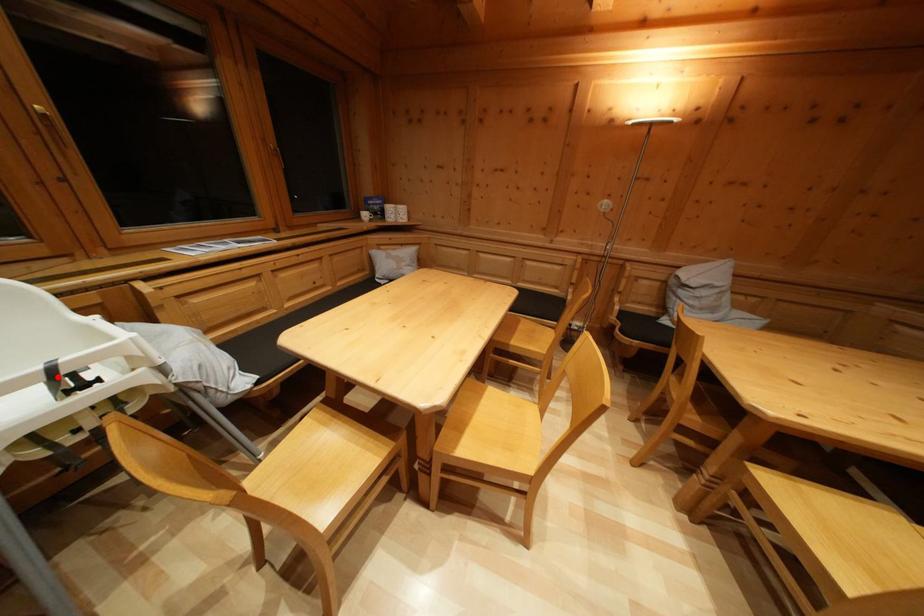
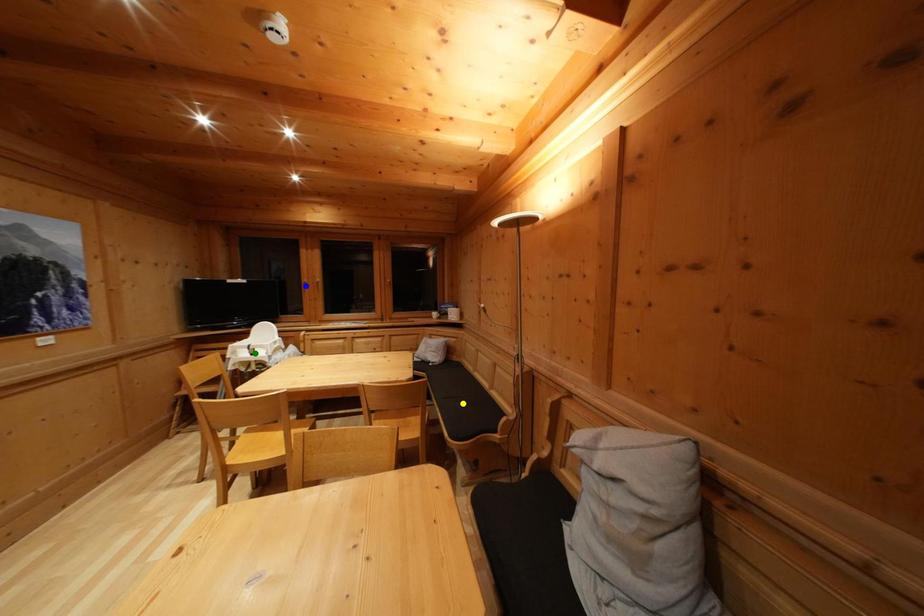
Question: I am providing you with two images of the same scene from different viewpoints. A red point is marked on the first image. You are given multiple points on the second image. Which point in image 2 is actually the same real-world point as the red point in image 1?

Choices:
 (A) yellow point
 (B) green point
 (C) blue point

Answer: (B)